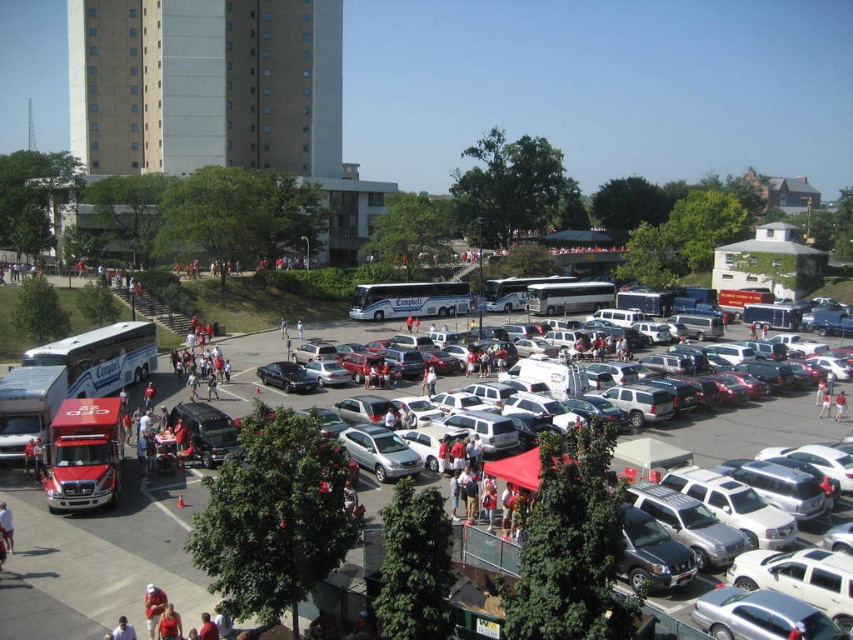
Question: Does white metallic bus at left have a smaller size compared to blue metallic bus at center?

Choices:
 (A) yes
 (B) no

Answer: (A)

Question: Which object is the closest to the white metallic bus at center?

Choices:
 (A) white matte bus at upper left
 (B) white metallic bus at left
 (C) red matte truck at left
 (D) blue metallic bus at center

Answer: (D)

Question: Which object appears closest to the camera in this image?

Choices:
 (A) white metallic bus at center
 (B) white matte bus at upper left
 (C) blue metallic bus at center

Answer: (B)

Question: Is white metallic bus at center in front of blue metallic bus at center?

Choices:
 (A) yes
 (B) no

Answer: (A)

Question: Does white metallic bus at left have a smaller size compared to white metallic bus at center?

Choices:
 (A) no
 (B) yes

Answer: (B)

Question: Which is nearer to the white metallic bus at center?

Choices:
 (A) red matte truck at left
 (B) blue metallic bus at center
 (C) silver metallic bus at center

Answer: (B)